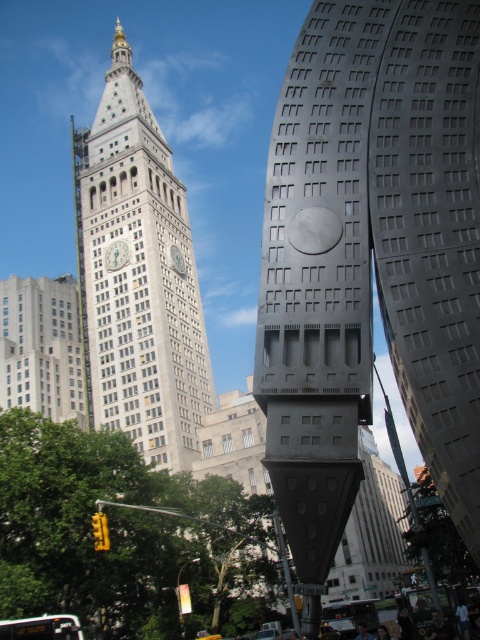
You are a city planner evaluating the urban layout. You need to determine if the gray metallic sculpture at center can be seen from the top of the white stone clock tower at center. Based on their heights, can you confirm visibility?

The gray metallic sculpture at center is not as tall as the white stone clock tower at center. Since the sculpture is shorter, it might be partially or fully obscured from the clock tower top depending on distance and terrain, but height alone suggests it could be visible below.

You are an architect analyzing the urban skyline. You notice the white stone clock tower at center and the silver metallic clock at upper center. Which structure has a greater height?

The white stone clock tower at center is taller than the silver metallic clock at upper center.

You are an architect analyzing the urban scene. You notice the white stone clock tower at center and the silver metallic clock at upper center. Which of these two objects is bigger in terms of physical size?

The white stone clock tower at center has a larger size compared to the silver metallic clock at upper center, so the white stone clock tower at center is bigger.